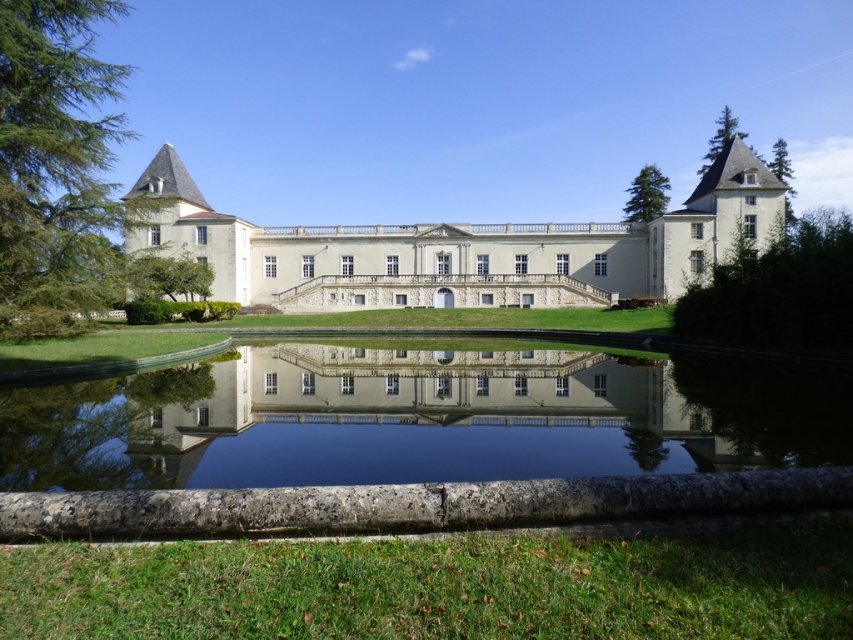
Question: Is green leafy tree at left further to the viewer compared to green textured pine tree at upper right?

Choices:
 (A) no
 (B) yes

Answer: (A)

Question: Based on their relative distances, which object is farther from the green leafy tree at right?

Choices:
 (A) green textured tree at upper right
 (B) green leafy tree at left
 (C) white smooth palace at center
 (D) green textured pine tree at upper right

Answer: (D)

Question: Which point appears farthest from the camera in this image?

Choices:
 (A) (12, 104)
 (B) (776, 236)
 (C) (730, 132)
 (D) (785, 216)

Answer: (C)

Question: Can you confirm if green leafy tree at left is wider than green leafy tree at right?

Choices:
 (A) no
 (B) yes

Answer: (A)

Question: Estimate the real-world distances between objects in this image. Which object is closer to the green coniferous tree at upper right?

Choices:
 (A) green leafy tree at right
 (B) transparent glass water at center

Answer: (A)

Question: Is green leafy tree at left wider than green textured pine tree at upper right?

Choices:
 (A) no
 (B) yes

Answer: (A)